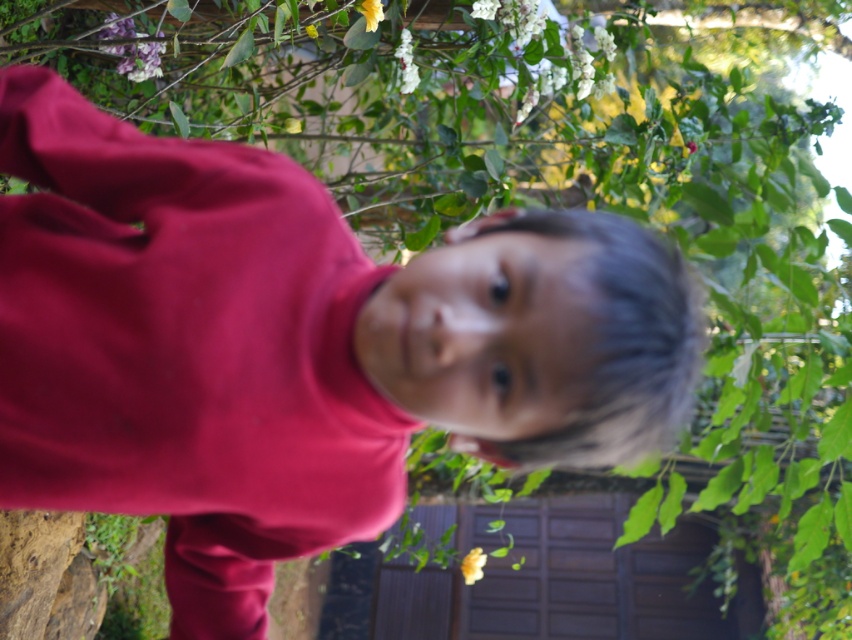
You are a bee that needs to pollinate both the white matte flower at upper center and the yellow matte flower at upper center. Which flower should you visit first if you want to minimize the distance traveled?

The white matte flower at upper center and the yellow matte flower at upper center are both at upper center, so the distance between them is only 20.56 inches. Since they are close to each other, you can visit either one first as the distance between them is minimal.

You are a photographer trying to capture a clear shot of the white matte flower at upper center. However, the matte purple flower at upper left is blocking your view. Can you move the purple flower to the side so you can take the photo?

The matte purple flower at upper left is in front of the white matte flower at upper center, so moving it aside would allow you to take a clear photo of the white matte flower at upper center.

You are a gardener who wants to plant a new flower in the garden. You have two yellow matte flowers in your basket. One is the yellow matte flower at lower center and the other is the yellow matte flower at upper center. Which flower should you choose if you want to plant a flower that is wider?

The yellow matte flower at lower center might be wider than yellow matte flower at upper center, so you should choose the yellow matte flower at lower center.